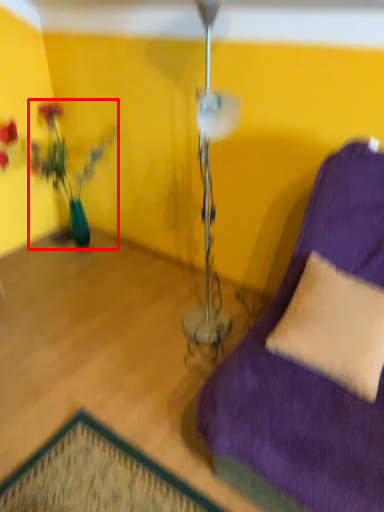
Question: Considering the relative positions of houseplant (annotated by the red box) and pillow in the image provided, where is houseplant (annotated by the red box) located with respect to the staircase?

Choices:
 (A) right
 (B) left

Answer: (B)